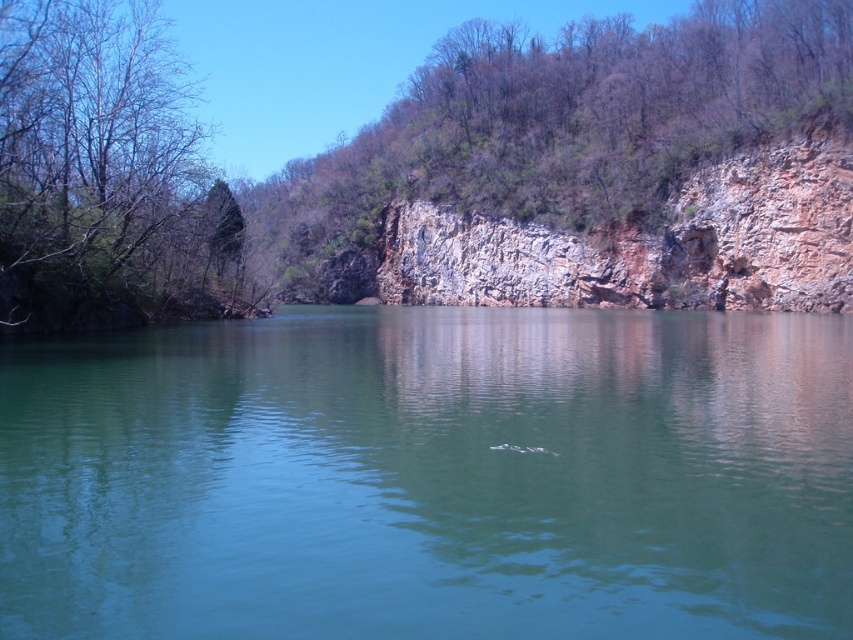
The width and height of the screenshot is (853, 640). What are the coordinates of `green leafy tree at left` in the screenshot? It's located at (109, 156).

Who is more forward, (51, 44) or (428, 241)?

Point (51, 44) is in front.

Is point (49, 4) closer to camera compared to point (788, 212)?

Yes.

Identify the location of green leafy tree at left. (109, 156).

Is green smooth water at center thinner than green leafy tree at left?

Incorrect, green smooth water at center's width is not less than green leafy tree at left's.

Is point (184, 392) less distant than point (184, 170)?

Yes, it is.

Is point (65, 381) positioned behind point (45, 120)?

No, it is in front of (45, 120).

Find the location of `green smooth water at center`. green smooth water at center is located at coordinates (431, 476).

Between green smooth water at center and rocky cliff at right, which one is positioned lower?

Positioned lower is green smooth water at center.

Does point (480, 602) lie in front of point (720, 269)?

Yes, point (480, 602) is in front of point (720, 269).

Which is behind, point (575, 356) or point (496, 268)?

Positioned behind is point (496, 268).

Find the location of a particular element. This screenshot has height=640, width=853. green smooth water at center is located at coordinates (431, 476).